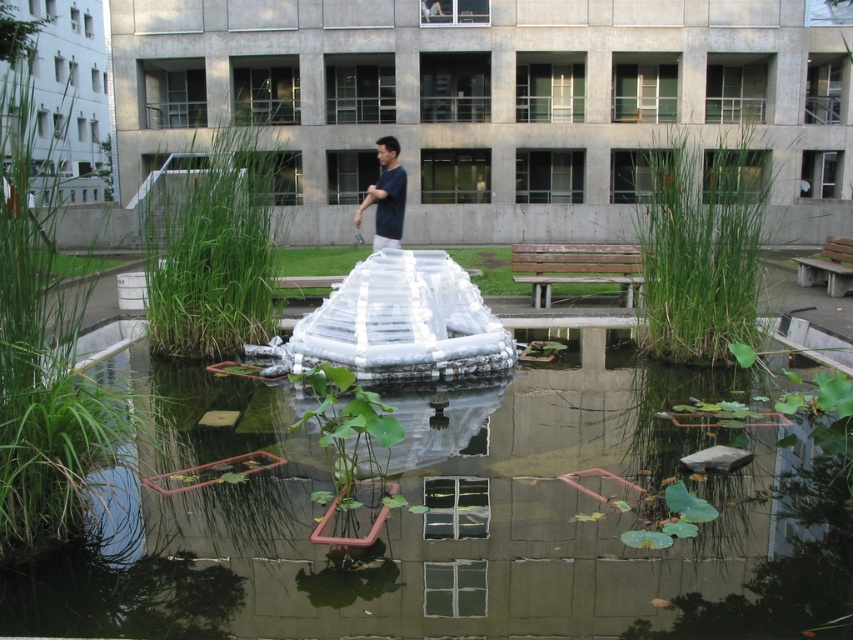
Between clear water at center and dark blue shirt at center, which one is positioned lower?

clear water at center is lower down.

Is point (181, 445) positioned before point (381, 221)?

Yes, point (181, 445) is closer to viewer.

Find the location of a particular element. clear water at center is located at coordinates (463, 522).